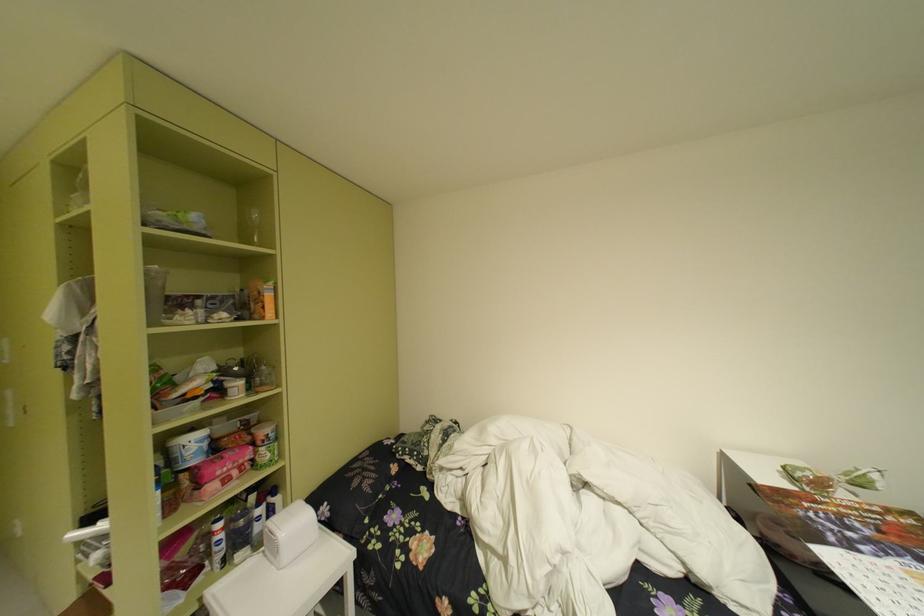
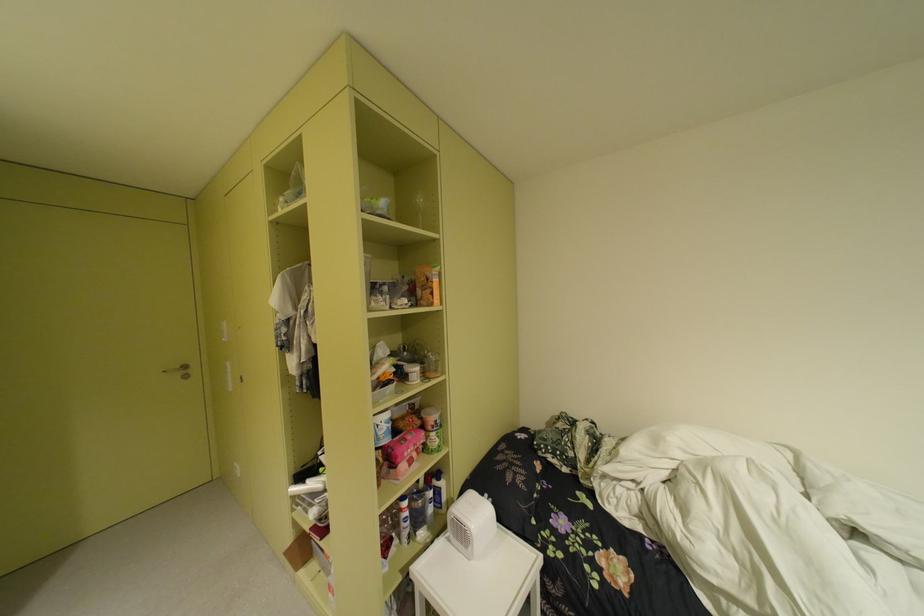
Question: The camera is either moving clockwise (left) or counter-clockwise (right) around the object. The first image is from the beginning of the video and the second image is from the end. Is the camera moving left or right when shooting the video?

Choices:
 (A) Left
 (B) Right

Answer: (B)